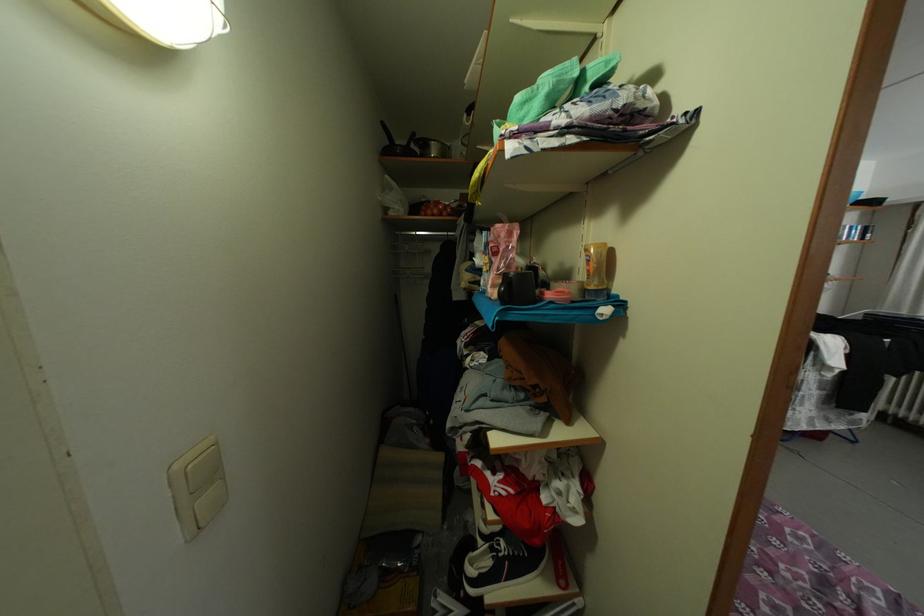
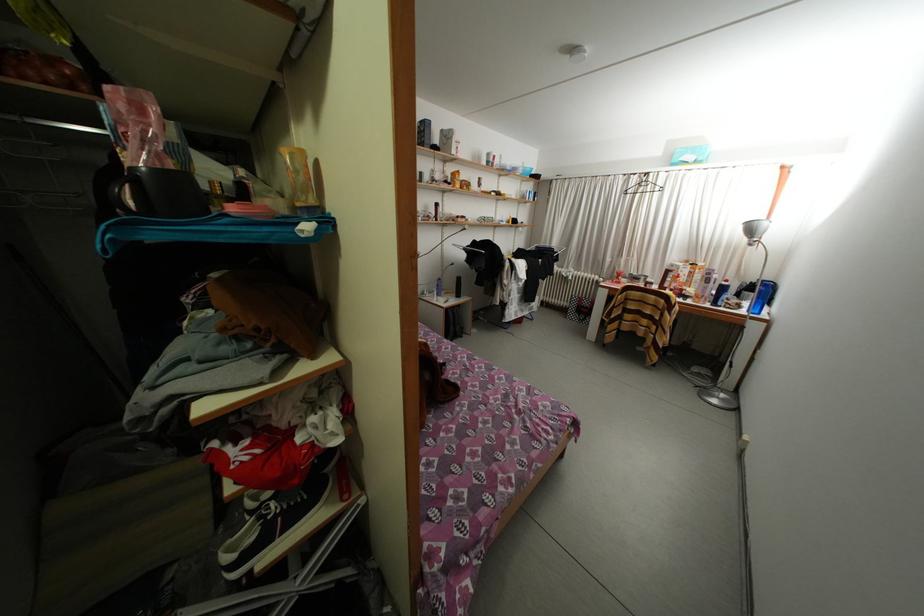
Find the pixel in the second image that matches (x=598, y=293) in the first image.

(306, 209)